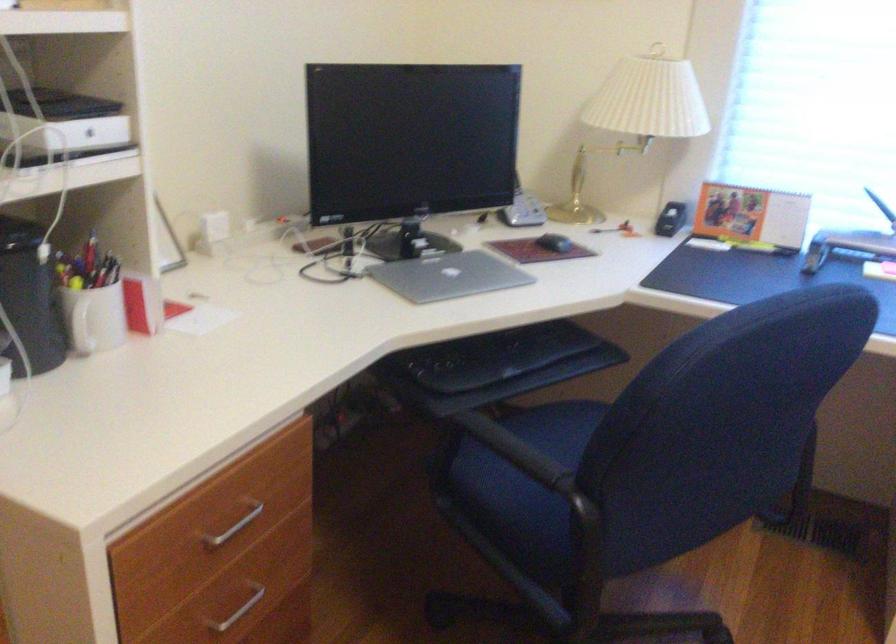
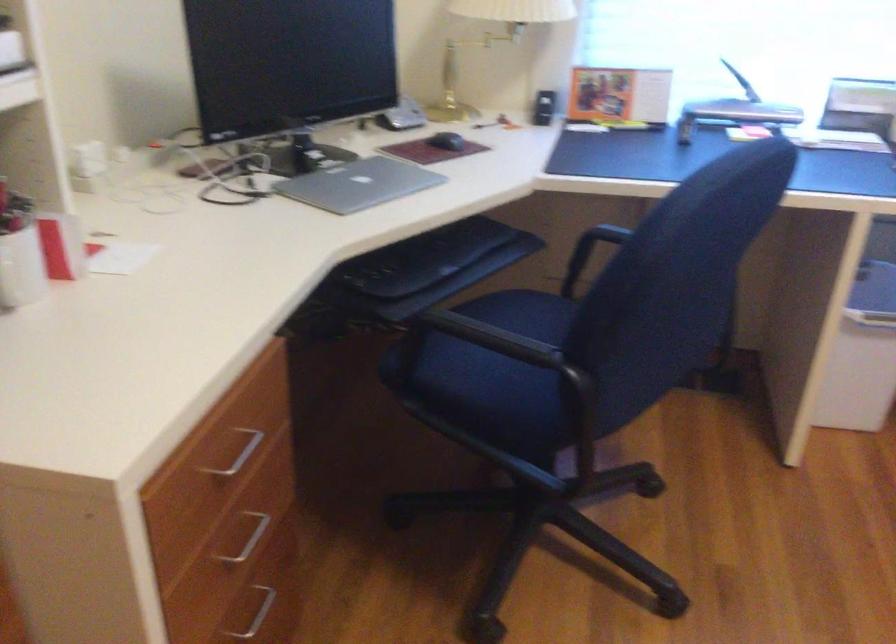
Question: I am providing you with two images of the same scene from different viewpoints. Which of the following objects are not visible in image2?

Choices:
 (A) black computer mouse
 (B) black keyboard tray
 (C) silver drawer handle
 (D) none of these

Answer: (D)